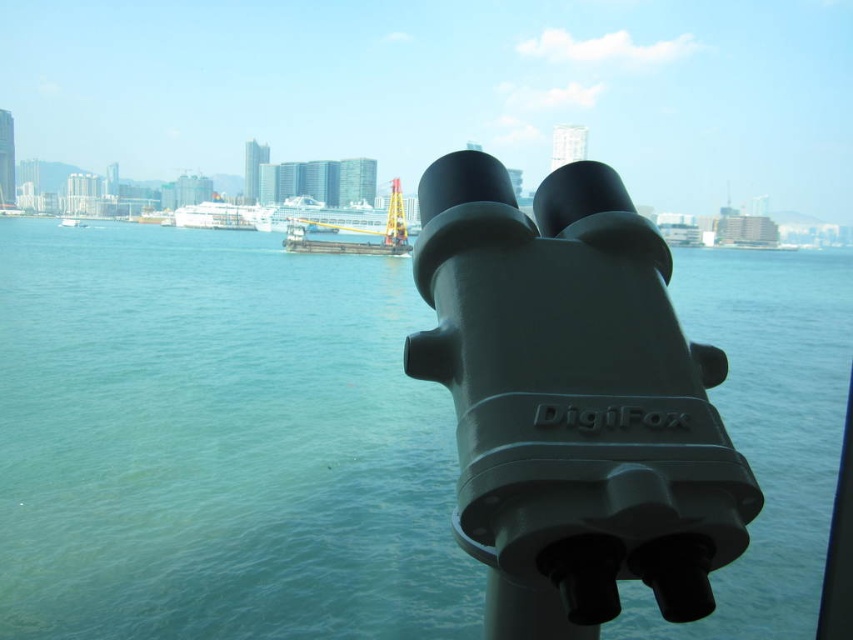
Does matte black telescope at center have a lesser height compared to yellow metallic crane at center?

No.

The image size is (853, 640). What do you see at coordinates (572, 401) in the screenshot? I see `matte black telescope at center` at bounding box center [572, 401].

Locate an element on the screen. The width and height of the screenshot is (853, 640). matte black telescope at center is located at coordinates (572, 401).

Who is positioned more to the right, green matte water at center or matte black telescope at center?

From the viewer's perspective, green matte water at center appears more on the right side.

Is green matte water at center wider than matte black telescope at center?

Yes.

Which is in front, point (386, 445) or point (654, 369)?

Positioned in front is point (654, 369).

This screenshot has height=640, width=853. Find the location of `green matte water at center`. green matte water at center is located at coordinates point(218,444).

Can you confirm if yellow metallic crane at center is taller than white glossy cruise ship at center?

Yes, yellow metallic crane at center is taller than white glossy cruise ship at center.

Is yellow metallic crane at center above white glossy cruise ship at center?

No.

Is point (340, 252) farther from viewer compared to point (216, 211)?

No, it is not.

Find the location of a particular element. The width and height of the screenshot is (853, 640). yellow metallic crane at center is located at coordinates (354, 230).